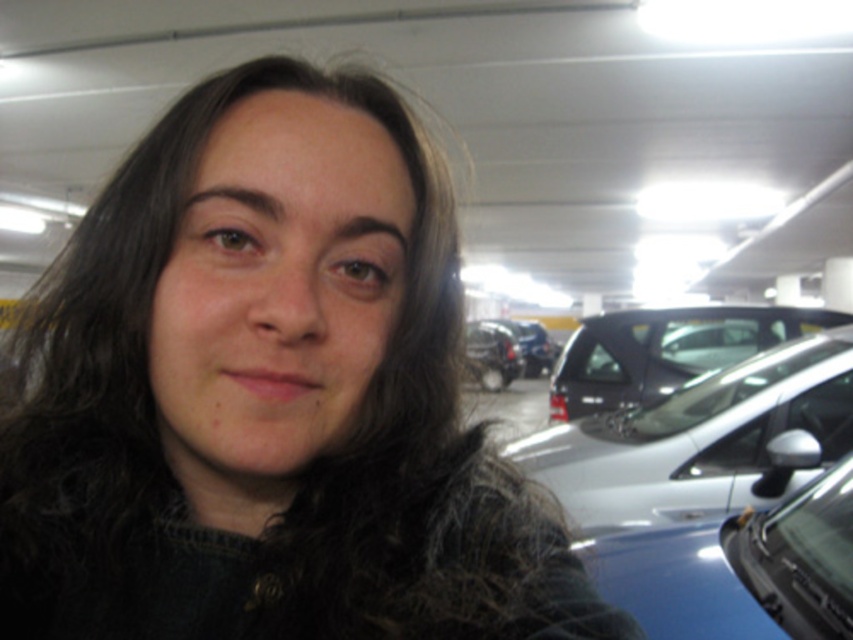
You are a parking attendant who needs to determine which vehicle is shorter between the shiny black suv at center and the shiny black car at center. Based on the scene, which one should you identify as the shorter vehicle?

The shiny black suv at center is not as tall as the shiny black car at center, so the shiny black suv at center is shorter.

You are a parking attendant who needs to fit both the satin silver car at right and the shiny black car at center into a single parking spot that can only accommodate one car. Which car would you choose to park first?

The satin silver car at right is larger in size than the shiny black car at center, so you should park the shiny black car at center first to ensure it fits in the parking spot.